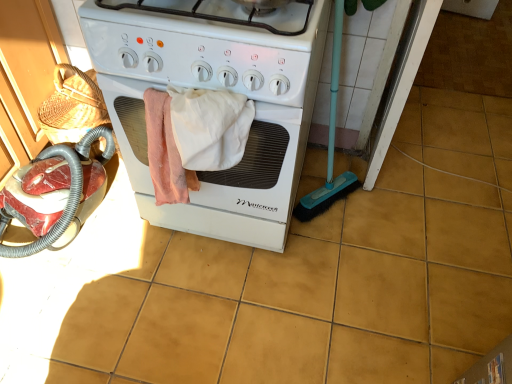
Question: Considering the relative sizes of white cotton towel at center and yellow matte tile at center in the image provided, is white cotton towel at center bigger than yellow matte tile at center?

Choices:
 (A) no
 (B) yes

Answer: (B)

Question: Is white cotton towel at center taller than yellow matte tile at center?

Choices:
 (A) no
 (B) yes

Answer: (B)

Question: From a real-world perspective, is white cotton towel at center positioned over yellow matte tile at center based on gravity?

Choices:
 (A) yes
 (B) no

Answer: (A)

Question: Does white cotton towel at center lie in front of yellow matte tile at center?

Choices:
 (A) no
 (B) yes

Answer: (B)

Question: Is white cotton towel at center outside of yellow matte tile at center?

Choices:
 (A) no
 (B) yes

Answer: (B)

Question: From the image's perspective, is white matte stove at center located above or below white cotton towel at center?

Choices:
 (A) below
 (B) above

Answer: (B)

Question: Is white matte stove at center wider or thinner than white cotton towel at center?

Choices:
 (A) wide
 (B) thin

Answer: (A)

Question: Is white matte stove at center situated inside white cotton towel at center or outside?

Choices:
 (A) outside
 (B) inside

Answer: (A)

Question: From a real-world perspective, is white matte stove at center physically located above or below white cotton towel at center?

Choices:
 (A) above
 (B) below

Answer: (B)

Question: Is white cotton towel at center in front of or behind white glossy gas stove at center in the image?

Choices:
 (A) behind
 (B) front

Answer: (A)

Question: From a real-world perspective, is white cotton towel at center positioned above or below white glossy gas stove at center?

Choices:
 (A) below
 (B) above

Answer: (A)

Question: Based on their sizes in the image, would you say white cotton towel at center is bigger or smaller than white glossy gas stove at center?

Choices:
 (A) small
 (B) big

Answer: (A)

Question: Would you say white cotton towel at center is to the left or to the right of white glossy gas stove at center in the picture?

Choices:
 (A) left
 (B) right

Answer: (A)

Question: In terms of size, does white glossy gas stove at center appear bigger or smaller than yellow matte tile at center?

Choices:
 (A) big
 (B) small

Answer: (A)

Question: From the image's perspective, is white glossy gas stove at center above or below yellow matte tile at center?

Choices:
 (A) below
 (B) above

Answer: (B)